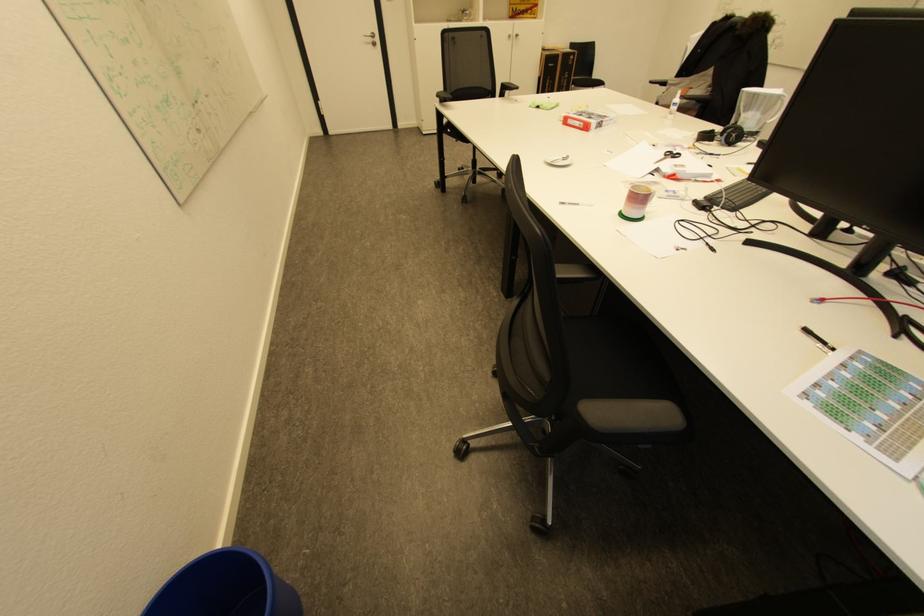
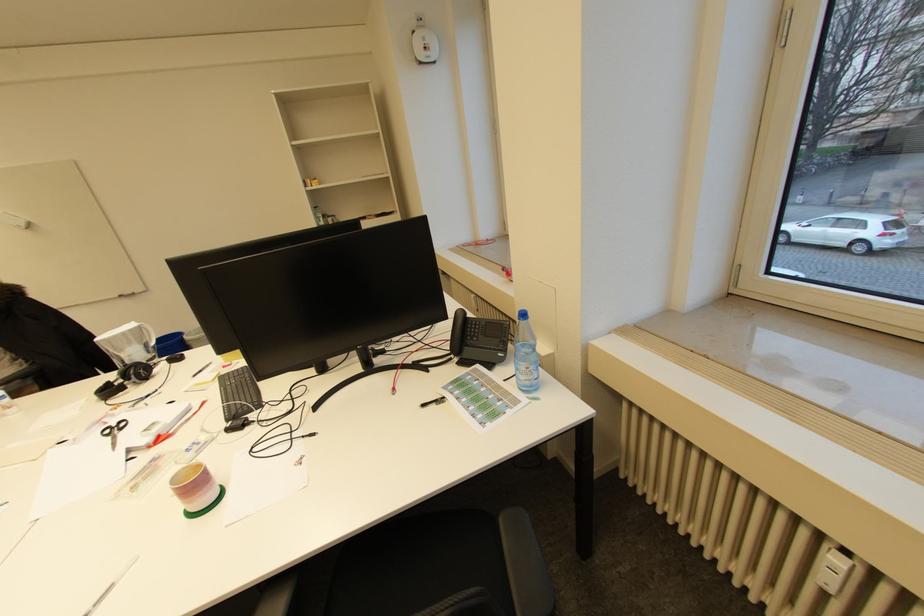
The point at (772, 97) is marked in the first image. Where is the corresponding point in the second image?

(129, 334)